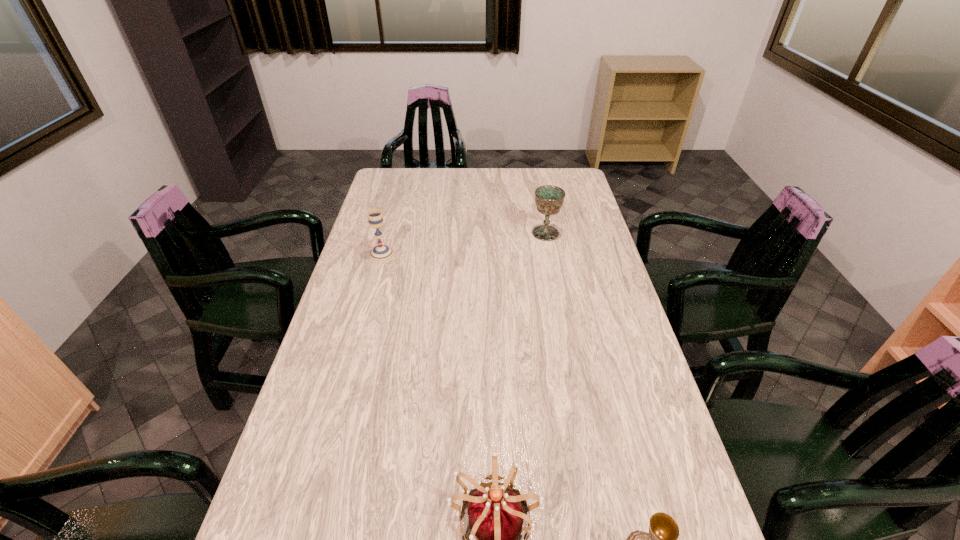
Where is `vacant space at the far right corner of the desktop`? vacant space at the far right corner of the desktop is located at coordinates (551, 180).

Find the location of a particular element. Image resolution: width=960 pixels, height=540 pixels. vacant region between the farthest object and the second nearest chalice is located at coordinates (464, 244).

What are the coordinates of `free spot between the second farthest object and the farthest chalice` in the screenshot? It's located at (464, 244).

Locate an element on the screen. Image resolution: width=960 pixels, height=540 pixels. the second closest object to the second object from left to right is located at coordinates (380, 253).

Select which object appears as the closest to the farthest chalice. Please provide its 2D coordinates. Your answer should be formatted as a tuple, i.e. [(x, y)], where the tuple contains the x and y coordinates of a point satisfying the conditions above.

[(380, 253)]

The width and height of the screenshot is (960, 540). I want to click on chalice that is the second closest to the leftmost chalice, so click(x=663, y=533).

Locate an element on the screen. The image size is (960, 540). chalice identified as the second closest to the leftmost chalice is located at coordinates (663, 533).